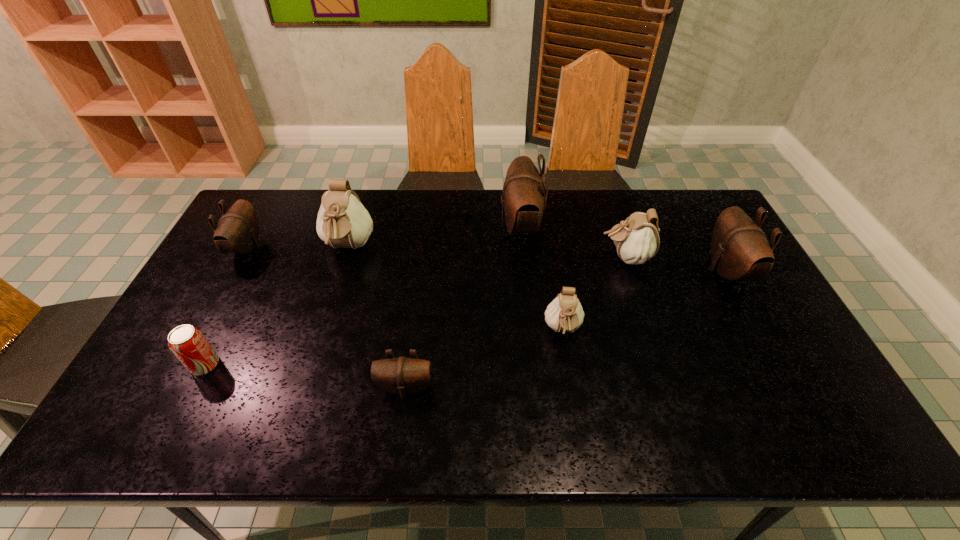
Where is `the sixth farthest pouch`? the sixth farthest pouch is located at coordinates (564, 314).

This screenshot has width=960, height=540. I want to click on soda can, so click(x=189, y=345).

Image resolution: width=960 pixels, height=540 pixels. In order to click on the third pouch from left to right in this screenshot , I will do `click(403, 376)`.

Locate an element on the screen. The height and width of the screenshot is (540, 960). the fourth object from left to right is located at coordinates (403, 376).

The width and height of the screenshot is (960, 540). What are the coordinates of `vacant space located with the flap open on the second brown pouch from right to left` in the screenshot? It's located at (479, 227).

Where is `vacant space situated with the flap open on the second brown pouch from right to left`? This screenshot has height=540, width=960. vacant space situated with the flap open on the second brown pouch from right to left is located at coordinates (418, 227).

Identify the location of blank space located with the flap open on the second brown pouch from right to left. Image resolution: width=960 pixels, height=540 pixels. (426, 227).

Locate an element on the screen. blank space located 0.110m on the front-facing side of the leftmost white pouch is located at coordinates (333, 297).

In order to click on free space located 0.260m with the flap open on the rightmost object in this screenshot , I will do `click(623, 271)`.

Image resolution: width=960 pixels, height=540 pixels. Identify the location of vacant space located with the flap open on the rightmost object. (594, 271).